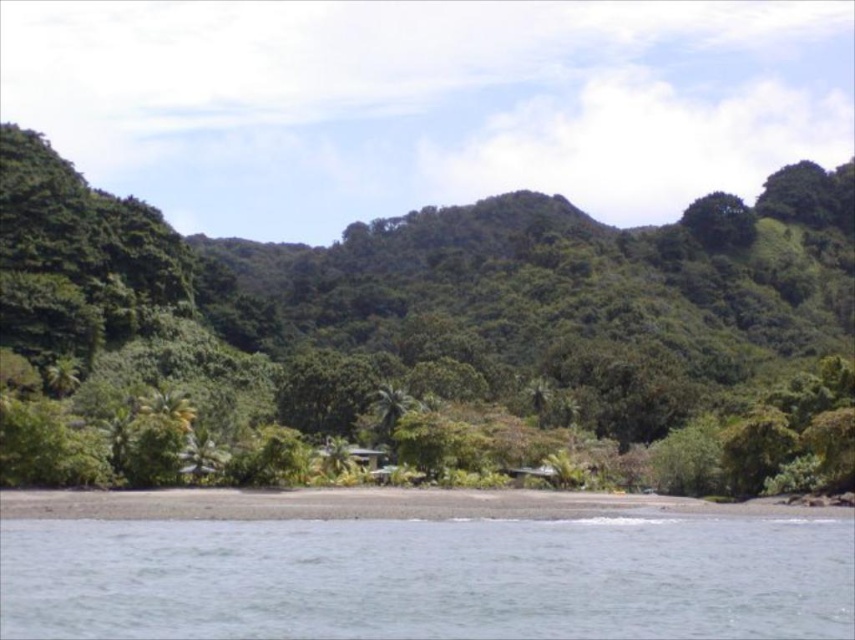
Can you confirm if clear water at lower left is wider than green leafy tree at upper right?

Indeed, clear water at lower left has a greater width compared to green leafy tree at upper right.

Between clear water at lower left and green leafy tree at upper right, which one is positioned higher?

green leafy tree at upper right is above.

Where is `clear water at lower left`? clear water at lower left is located at coordinates (428, 577).

In the scene shown: Can you confirm if green leafy tree at center is positioned above clear water at lower left?

Correct, green leafy tree at center is located above clear water at lower left.

The image size is (855, 640). Find the location of `green leafy tree at center`. green leafy tree at center is located at coordinates tap(422, 332).

Between green leafy tree at center and green leafy tree at upper right, which one appears on the left side from the viewer's perspective?

From the viewer's perspective, green leafy tree at center appears more on the left side.

Does green leafy tree at center have a lesser width compared to green leafy tree at upper right?

In fact, green leafy tree at center might be wider than green leafy tree at upper right.

Locate an element on the screen. The image size is (855, 640). green leafy tree at center is located at coordinates (422, 332).